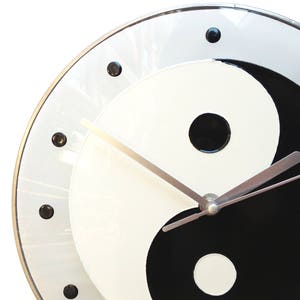
Find the location of a particular element. screw that holds hands on the clock is located at coordinates point(211,211).